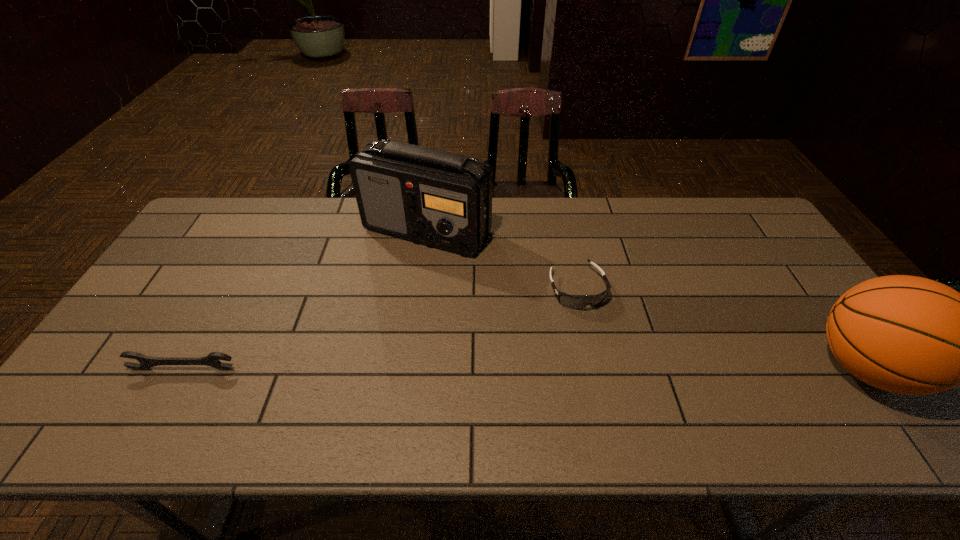
Find the location of a particular element. free spot on the desktop that is between the wrench and the basketball and is positioned on the front and sides of the second farthest object is located at coordinates (614, 368).

Where is `free space on the desktop that is between the leftmost object and the rightmost object and is positioned on the front panel of the farthest object`? The height and width of the screenshot is (540, 960). free space on the desktop that is between the leftmost object and the rightmost object and is positioned on the front panel of the farthest object is located at coordinates (437, 368).